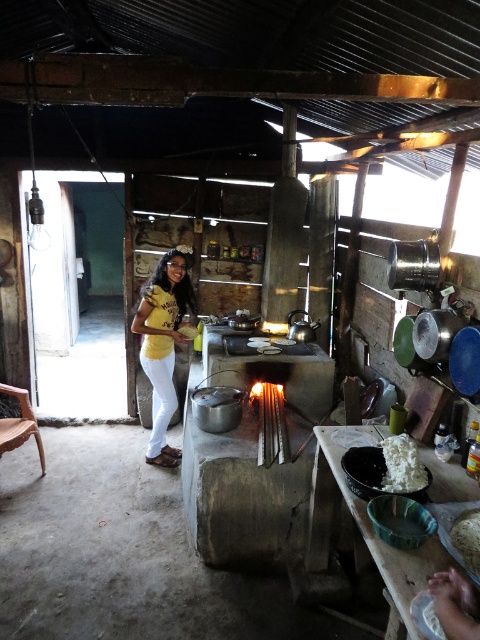
Who is more distant from viewer, (164,438) or (383,486)?

The point (164,438) is behind.

Looking at this image, can you confirm if yellow matte shirt at center is taller than white fluffy rice at lower right?

Correct, yellow matte shirt at center is much taller as white fluffy rice at lower right.

Who is more forward, [156,298] or [393,474]?

Point [393,474]

The image size is (480, 640). Identify the location of yellow matte shirt at center. (163, 344).